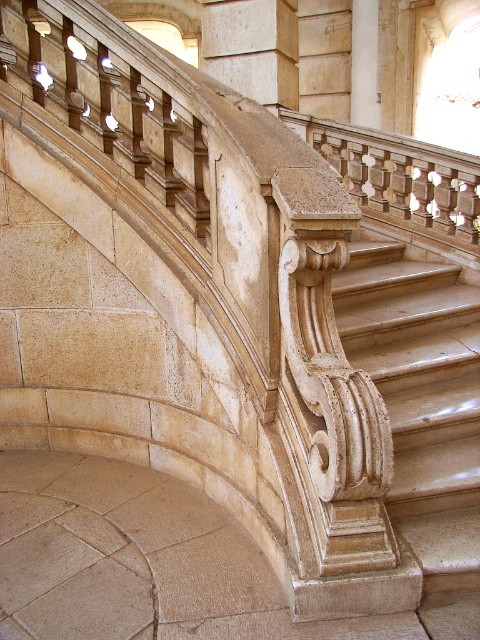
Question: Observing the image, what is the correct spatial positioning of polished beige marble stairs at center in reference to wooden carved column at upper center?

Choices:
 (A) below
 (B) above

Answer: (A)

Question: Which point is closer to the camera?

Choices:
 (A) (370, 246)
 (B) (283, 32)

Answer: (A)

Question: Is polished beige marble stairs at center wider than wooden carved column at upper center?

Choices:
 (A) no
 (B) yes

Answer: (B)

Question: Does polished beige marble stairs at center have a larger size compared to wooden carved column at upper center?

Choices:
 (A) no
 (B) yes

Answer: (B)